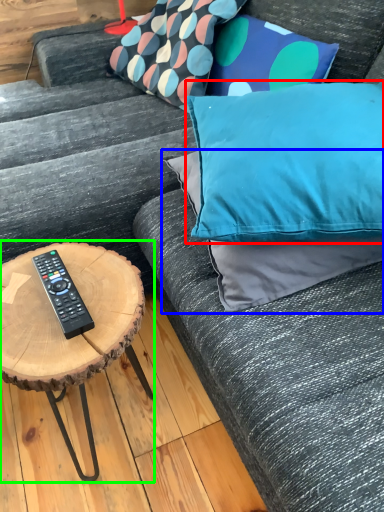
Question: Which object is positioned closest to pillow (highlighted by a red box)? Select from pillow (highlighted by a blue box) and coffee table (highlighted by a green box).

Choices:
 (A) pillow
 (B) coffee table

Answer: (A)